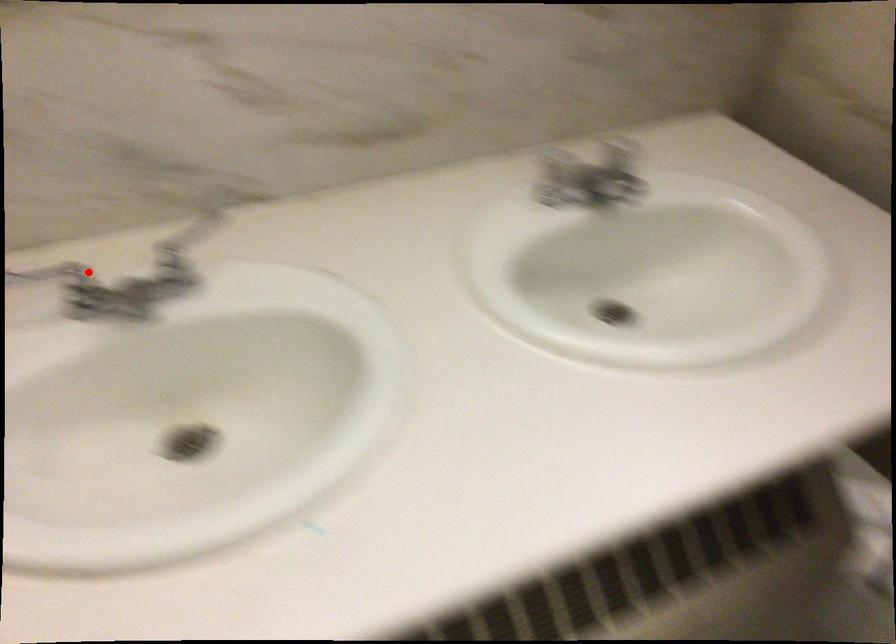
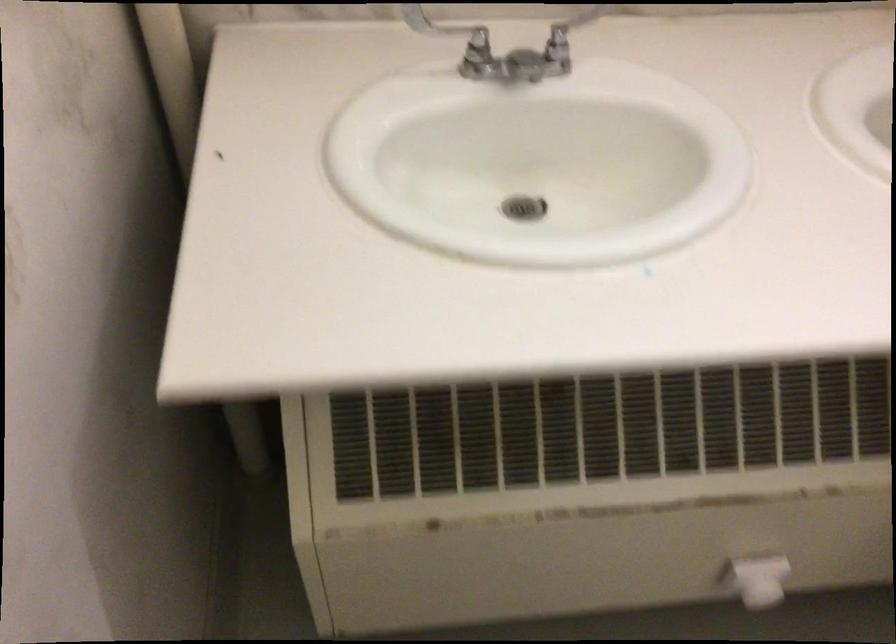
Locate, in the second image, the point that corresponds to the highlighted location in the first image.

(476, 37)